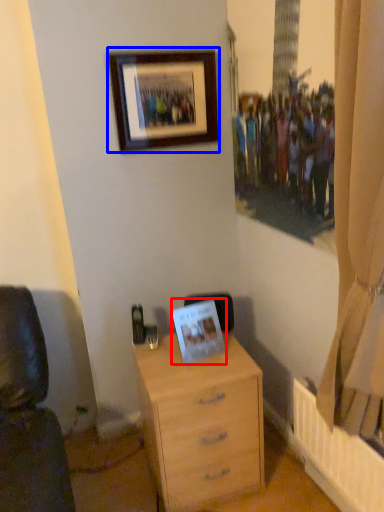
Question: Among these objects, which one is farthest to the camera, picture frame (highlighted by a red box) or picture frame (highlighted by a blue box)?

Choices:
 (A) picture frame
 (B) picture frame

Answer: (B)